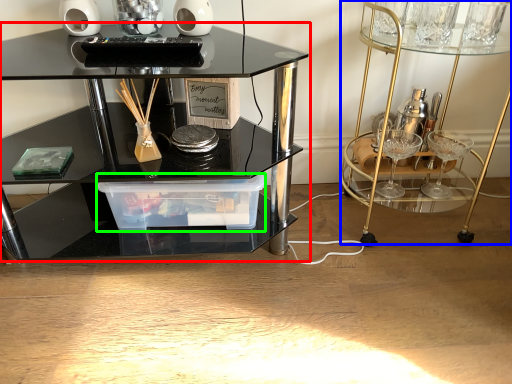
Question: Estimate the real-world distances between objects in this image. Which object is farther from table (highlighted by a red box), vanity (highlighted by a blue box) or glass box (highlighted by a green box)?

Choices:
 (A) vanity
 (B) glass box

Answer: (A)